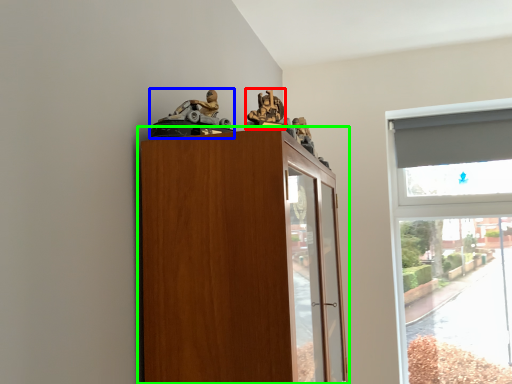
Question: Based on their relative distances, which object is nearer to toy (highlighted by a red box)? Choose from toy (highlighted by a blue box) and cupboard (highlighted by a green box).

Choices:
 (A) toy
 (B) cupboard

Answer: (A)